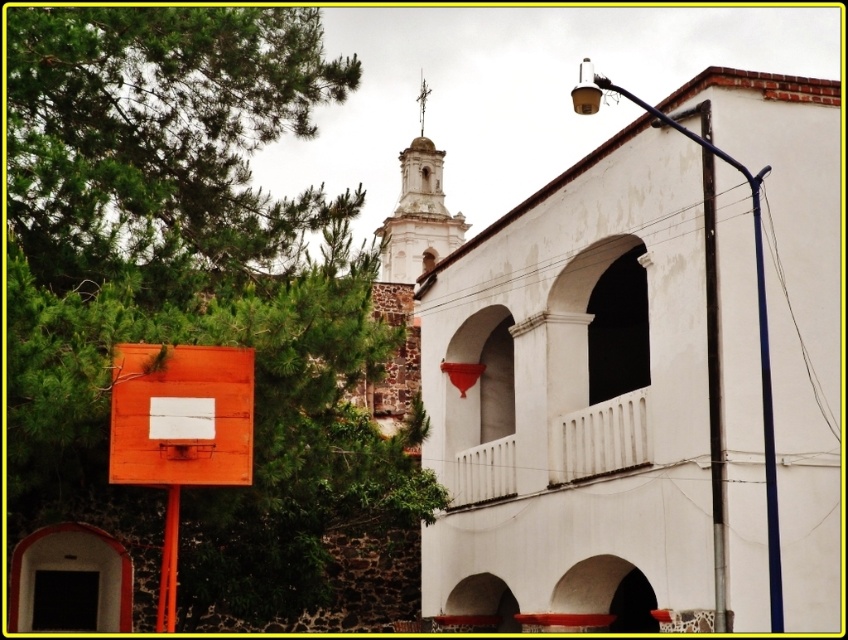
Does point (46, 308) come closer to viewer compared to point (148, 397)?

That is True.

The width and height of the screenshot is (848, 640). I want to click on green leafy tree at upper left, so click(193, 285).